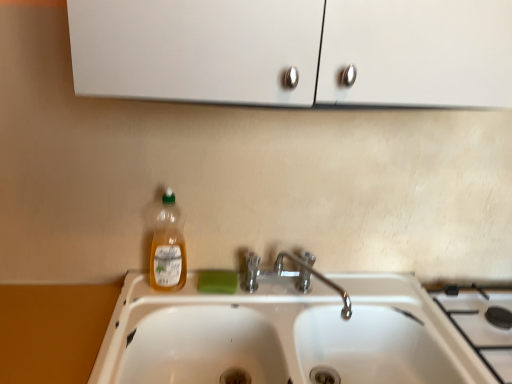
Question: From a real-world perspective, is green matte soap at sink on white glossy sink at center?

Choices:
 (A) yes
 (B) no

Answer: (A)

Question: Could white glossy sink at center be considered to be inside green matte soap at sink?

Choices:
 (A) no
 (B) yes

Answer: (A)

Question: Considering the relative sizes of green matte soap at sink and white glossy sink at center in the image provided, is green matte soap at sink shorter than white glossy sink at center?

Choices:
 (A) yes
 (B) no

Answer: (A)

Question: Can you confirm if green matte soap at sink is smaller than white glossy sink at center?

Choices:
 (A) no
 (B) yes

Answer: (B)

Question: Is green matte soap at sink touching white glossy sink at center?

Choices:
 (A) yes
 (B) no

Answer: (B)

Question: From a real-world perspective, is white glossy sink at center physically located above or below green matte soap at sink?

Choices:
 (A) below
 (B) above

Answer: (A)

Question: Based on their sizes in the image, would you say white glossy sink at center is bigger or smaller than green matte soap at sink?

Choices:
 (A) small
 (B) big

Answer: (B)

Question: Relative to green matte soap at sink, is white glossy sink at center in front or behind?

Choices:
 (A) front
 (B) behind

Answer: (A)

Question: Looking at their shapes, would you say white glossy sink at center is wider or thinner than green matte soap at sink?

Choices:
 (A) wide
 (B) thin

Answer: (A)

Question: From the image's perspective, is translucent plastic bottle at center positioned above or below chrome metallic faucet at sink center?

Choices:
 (A) above
 (B) below

Answer: (A)

Question: Is translucent plastic bottle at center wider or thinner than chrome metallic faucet at sink center?

Choices:
 (A) wide
 (B) thin

Answer: (B)

Question: In terms of size, does translucent plastic bottle at center appear bigger or smaller than chrome metallic faucet at sink center?

Choices:
 (A) small
 (B) big

Answer: (A)

Question: Does point (175, 273) appear closer or farther from the camera than point (340, 294)?

Choices:
 (A) farther
 (B) closer

Answer: (B)

Question: Looking at the image, does green matte soap at sink seem bigger or smaller compared to chrome metallic faucet at sink center?

Choices:
 (A) big
 (B) small

Answer: (B)

Question: From a real-world perspective, is green matte soap at sink physically located above or below chrome metallic faucet at sink center?

Choices:
 (A) below
 (B) above

Answer: (A)